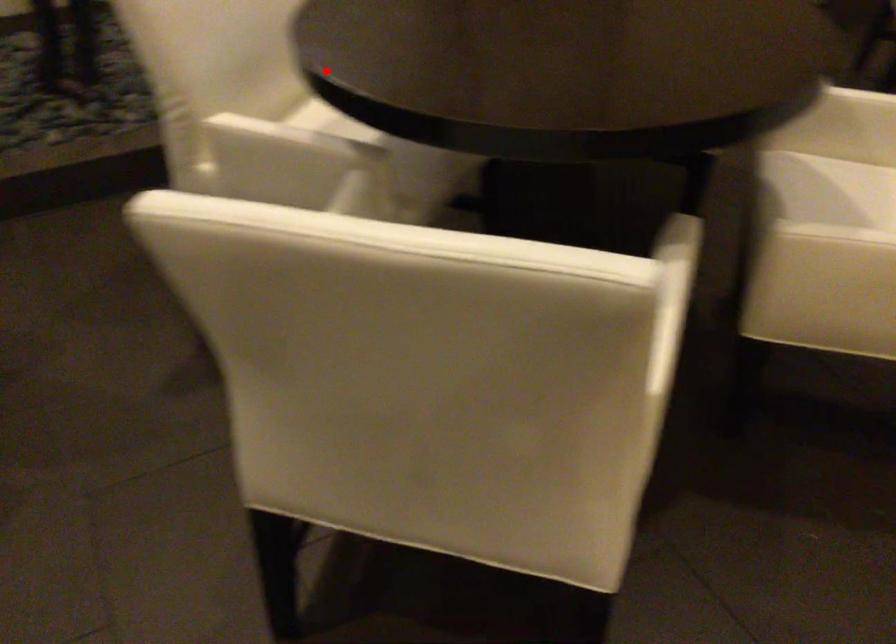
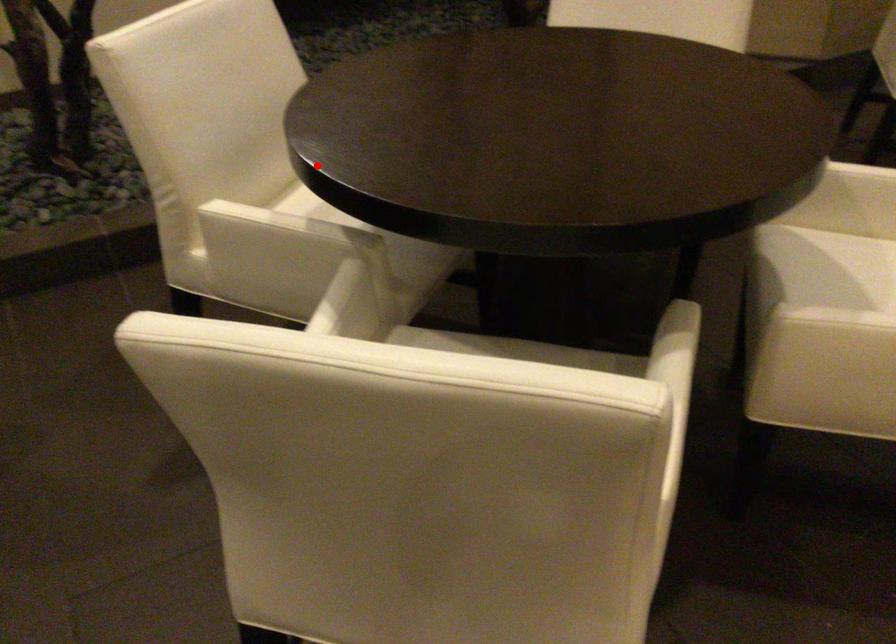
I am providing you with two images of the same scene from different viewpoints. A red point is marked on the first image and another point is marked on the second image. Do the highlighted points in image1 and image2 indicate the same real-world spot?

Yes